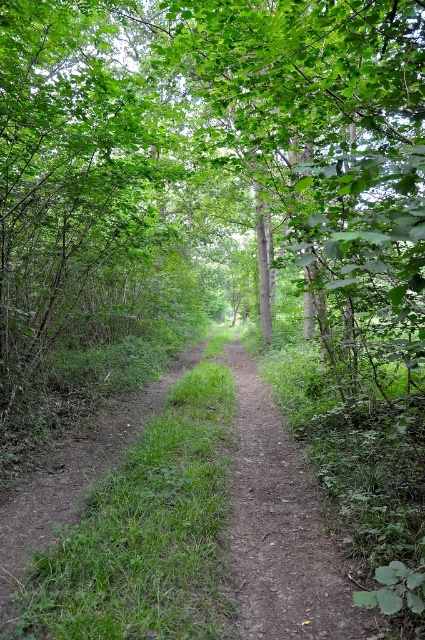
Question: Is dull brown dirt track at center below dirt path at center?

Choices:
 (A) no
 (B) yes

Answer: (A)

Question: Is dull brown dirt track at center smaller than dirt path at center?

Choices:
 (A) yes
 (B) no

Answer: (A)

Question: Can you confirm if dull brown dirt track at center is positioned to the left of dirt path at center?

Choices:
 (A) yes
 (B) no

Answer: (A)

Question: Among these objects, which one is farthest from the camera?

Choices:
 (A) dirt path at center
 (B) dull brown dirt track at center

Answer: (B)

Question: Which point is closer to the camera?

Choices:
 (A) (314, 540)
 (B) (297, 621)

Answer: (B)

Question: Which point is closer to the camera taking this photo?

Choices:
 (A) pyautogui.click(x=320, y=531)
 (B) pyautogui.click(x=209, y=456)

Answer: (A)